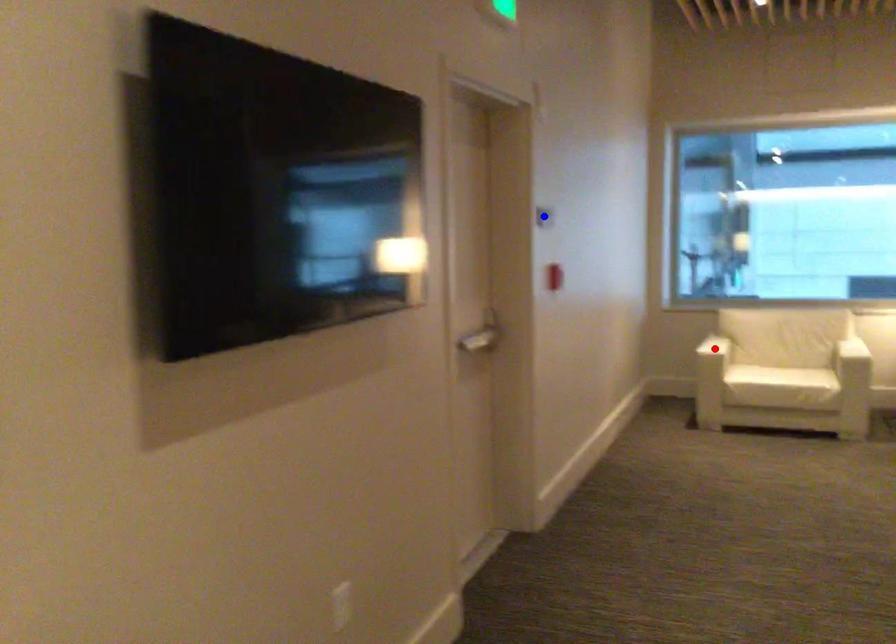
Question: Two points are marked on the image. Which point is closer to the camera?

Choices:
 (A) Blue point is closer.
 (B) Red point is closer.

Answer: (A)